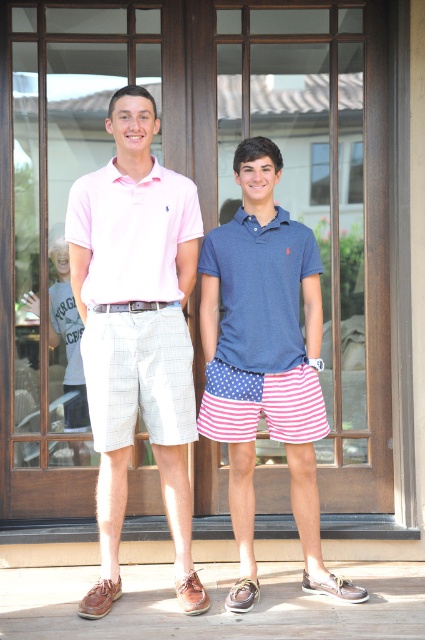
Question: Which point appears farthest from the camera in this image?

Choices:
 (A) (285, 266)
 (B) (249, 260)

Answer: (A)

Question: Observing the image, what is the correct spatial positioning of wooden door at center in reference to matte pink polo shirt at center?

Choices:
 (A) right
 (B) left

Answer: (B)

Question: Which of the following is the farthest from the observer?

Choices:
 (A) (285, 324)
 (B) (172, 396)
 (C) (268, 298)

Answer: (A)

Question: Which object is the farthest from the navy blue polo shirt at center?

Choices:
 (A) pink cotton polo shirt at center
 (B) wooden door at center
 (C) blue cotton polo shirt at center

Answer: (B)

Question: Is wooden door at center thinner than matte pink polo shirt at center?

Choices:
 (A) no
 (B) yes

Answer: (A)

Question: Can you confirm if wooden door at center is positioned below navy blue polo shirt at center?

Choices:
 (A) yes
 (B) no

Answer: (B)